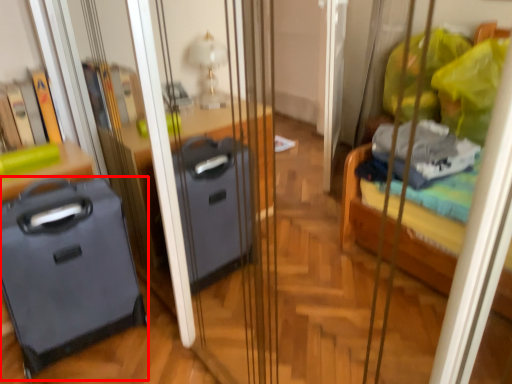
Question: Observing the image, what is the correct spatial positioning of luggage (annotated by the red box) in reference to furniture?

Choices:
 (A) left
 (B) right

Answer: (B)